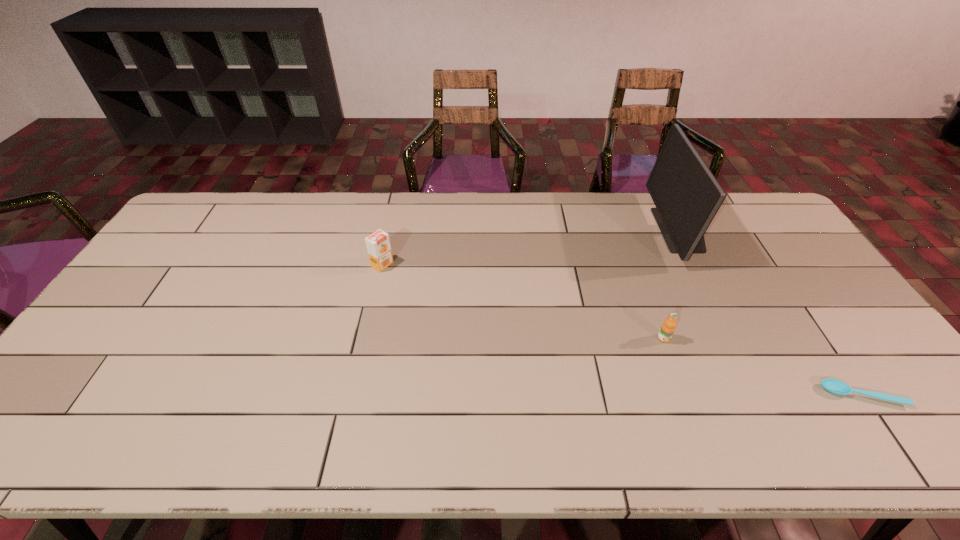
You are a GUI agent. You are given a task and a screenshot of the screen. Output one action in this format:
    pyautogui.click(x=<x>, y=<y>)
    Task: Click on the computer monitor
    This screenshot has width=960, height=540.
    Given the screenshot: What is the action you would take?
    pyautogui.click(x=687, y=196)

At what (x,y) coordinates should I click in order to perform the action: click on the second object from right to left. Please return your answer as a coordinate pair (x, y). Looking at the image, I should click on (687, 196).

At what (x,y) coordinates should I click in order to perform the action: click on the taller orange juice. Please return your answer as a coordinate pair (x, y). Image resolution: width=960 pixels, height=540 pixels. Looking at the image, I should click on (378, 244).

This screenshot has width=960, height=540. What are the coordinates of `the second tallest object` in the screenshot? It's located at (378, 244).

This screenshot has width=960, height=540. Identify the location of the second nearest object. (668, 327).

The image size is (960, 540). I want to click on the second object from left to right, so click(668, 327).

Identify the location of the rightmost object. The width and height of the screenshot is (960, 540). (835, 386).

You are a GUI agent. You are given a task and a screenshot of the screen. Output one action in this format:
    pyautogui.click(x=<x>, y=<y>)
    Task: Click on the spoon
    
    Given the screenshot: What is the action you would take?
    pyautogui.click(x=835, y=386)

The image size is (960, 540). What are the coordinates of `vacant space located 0.100m on the screen side of the second object from right to left` in the screenshot? It's located at (629, 230).

Where is `vacant space located 0.100m on the screen side of the second object from right to left`? This screenshot has width=960, height=540. vacant space located 0.100m on the screen side of the second object from right to left is located at coordinates (629, 230).